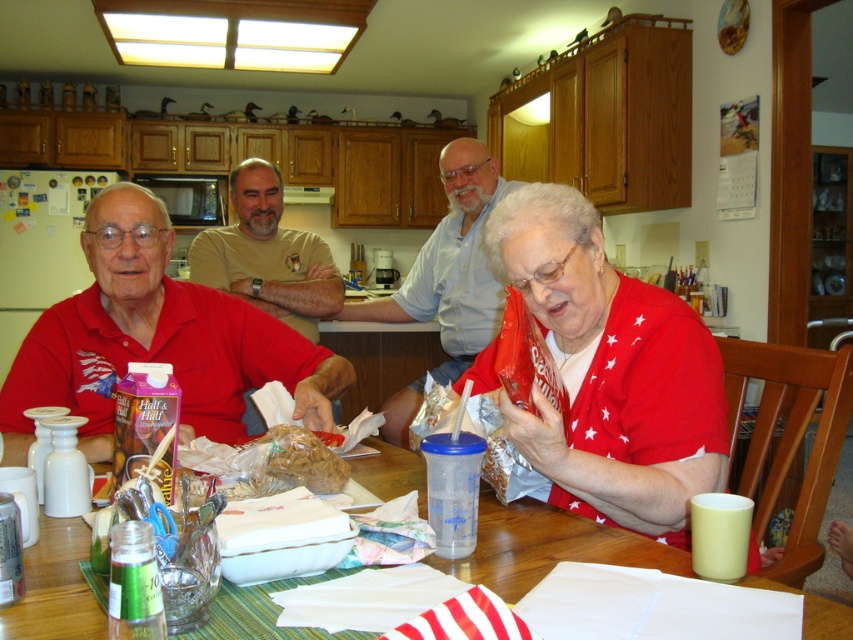
Question: Which object is the closest to the brown cotton t-shirt at center?

Choices:
 (A) wooden table at center
 (B) matte red shirt at left
 (C) light blue button-down shirt at center

Answer: (C)

Question: Is red cotton shirt at left behind light blue button-down shirt at center?

Choices:
 (A) no
 (B) yes

Answer: (A)

Question: Is matte red shirt at left positioned before red cotton shirt at left?

Choices:
 (A) no
 (B) yes

Answer: (B)

Question: Can you confirm if matte red sweater at center is wider than translucent plastic bag of cookies at center?

Choices:
 (A) yes
 (B) no

Answer: (A)

Question: Which object appears closest to the camera in this image?

Choices:
 (A) translucent plastic bag of cookies at center
 (B) matte red shirt at left
 (C) light blue button-down shirt at center

Answer: (B)

Question: Estimate the real-world distances between objects in this image. Which object is farther from the matte red shirt at left?

Choices:
 (A) translucent plastic bag of cookies at center
 (B) matte red sweater at center

Answer: (A)